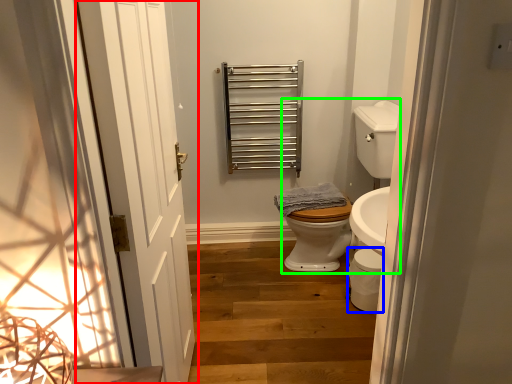
Question: Estimate the real-world distances between objects in this image. Which object is farther from door (highlighted by a red box), toilet bowl (highlighted by a blue box) or sink (highlighted by a green box)?

Choices:
 (A) toilet bowl
 (B) sink

Answer: (B)